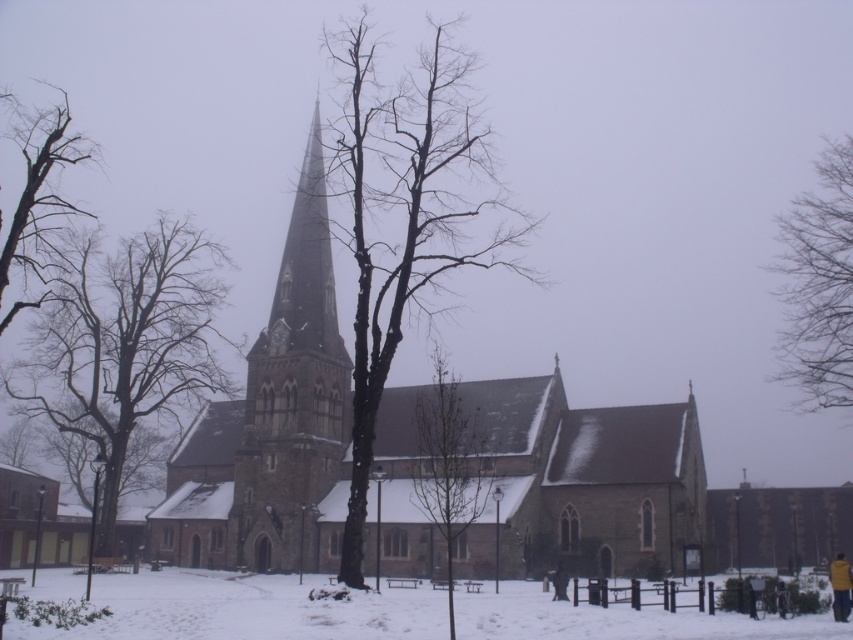
You are standing at the end of the snow path and want to walk to the brown stone church at center. Which direction should you walk to avoid the brown textured tree at center?

The brown stone church at center is positioned under the brown textured tree at center, so you should walk towards the church directly as it is located beneath the tree, meaning the tree is above it in the image, so walking straight towards the church would avoid the tree.

You are a visitor at the church and want to walk from the wooden fence to the church entrance. You see the white powdery snow at lower center and the yellow fabric jacket at lower right. Which object is higher in elevation?

The white powdery snow at lower center has a greater height compared to the yellow fabric jacket at lower right, so the white powdery snow at lower center is higher in elevation.

You are standing at the entrance of the church and want to take a photo of the dark gray stone tower at center. If you move 0.2 units to the left along the x axis, will the tower still be in the frame?

Since the dark gray stone tower at center is positioned at point 0.617 on the x axis, moving 0.2 units to the left would bring you to 0.417. As long as the camera frame extends beyond this point, the tower will remain in view. However, without knowing the frame width, it is impossible to definitively say. But based on standard framing, it should still be visible as the tower is centrally located.